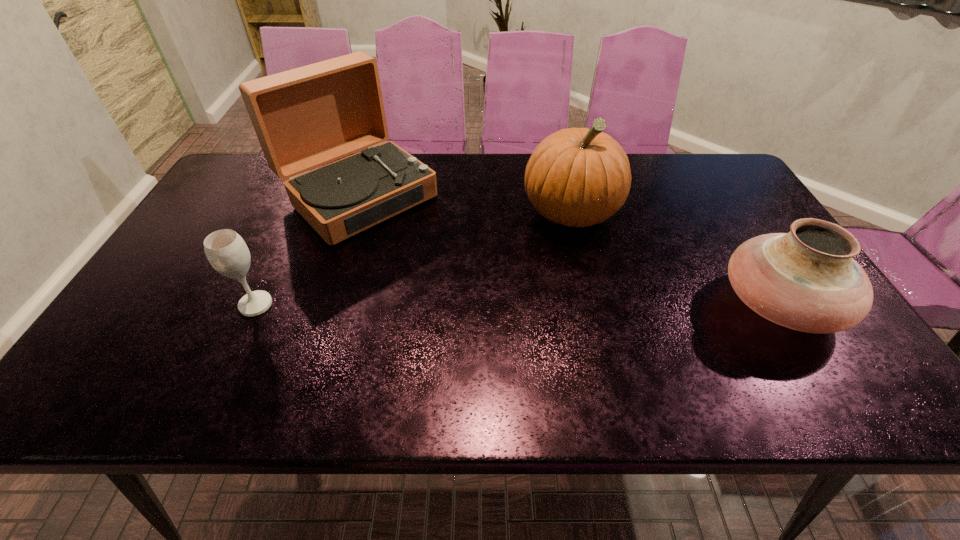
Where is `unoccupied area between the pumpkin and the phonograph record`? The width and height of the screenshot is (960, 540). unoccupied area between the pumpkin and the phonograph record is located at coordinates (465, 204).

In order to click on vacant area between the rightmost object and the pumpkin in this screenshot , I will do `click(675, 258)`.

At what (x,y) coordinates should I click in order to perform the action: click on free spot between the pumpkin and the wineglass. Please return your answer as a coordinate pair (x, y). The height and width of the screenshot is (540, 960). Looking at the image, I should click on (414, 258).

I want to click on free space between the wineglass and the pumpkin, so click(x=414, y=258).

Where is `vacant space that's between the phonograph record and the wineglass`? vacant space that's between the phonograph record and the wineglass is located at coordinates (307, 251).

The height and width of the screenshot is (540, 960). I want to click on vacant area between the rightmost object and the pumpkin, so click(675, 258).

Find the location of `empty location between the phonograph record and the wineglass`. empty location between the phonograph record and the wineglass is located at coordinates (307, 251).

At what (x,y) coordinates should I click in order to perform the action: click on free space that is in between the pottery and the pumpkin. Please return your answer as a coordinate pair (x, y). This screenshot has height=540, width=960. Looking at the image, I should click on (675, 258).

Identify the location of vacant space that is in between the rightmost object and the wineglass. (517, 305).

Find the location of a particular element. This screenshot has width=960, height=540. free spot between the rightmost object and the wineglass is located at coordinates (517, 305).